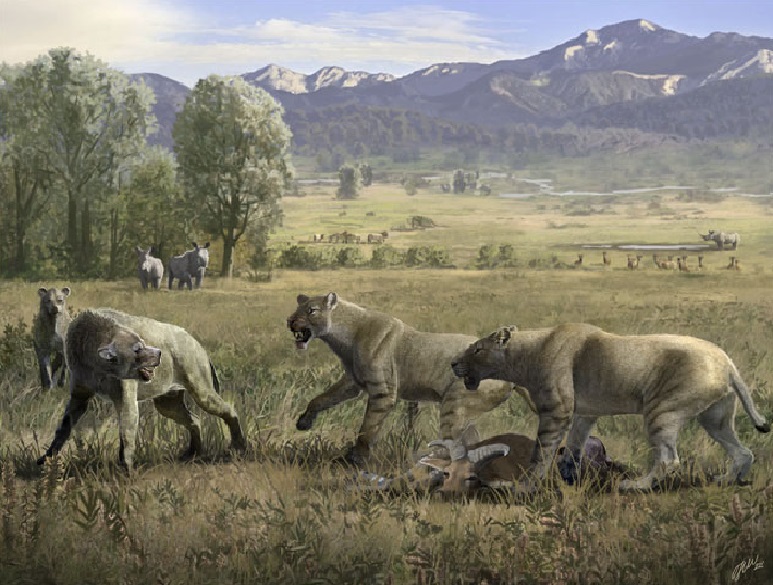
The height and width of the screenshot is (585, 773). In order to click on painting in this screenshot , I will do `click(505, 250)`.